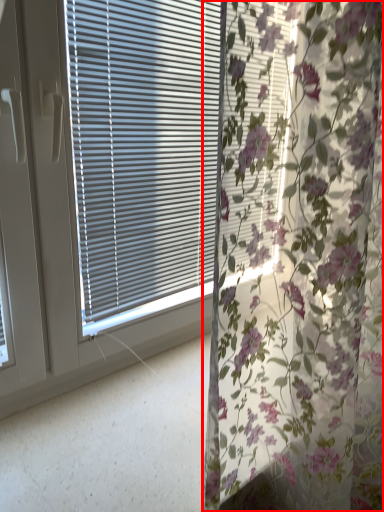
Question: Observing the image, what is the correct spatial positioning of curtain (annotated by the red box) in reference to window blind?

Choices:
 (A) left
 (B) right

Answer: (B)